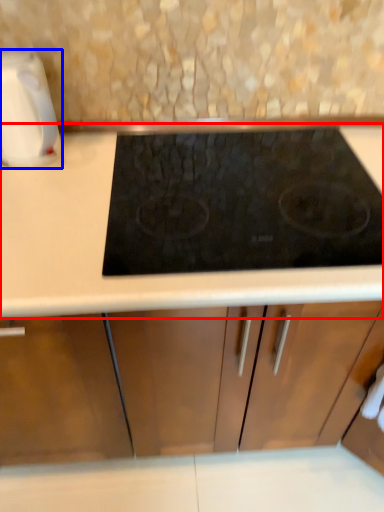
Question: Which of the following is the farthest to the observer, countertop (highlighted by a red box) or kitchen appliance (highlighted by a blue box)?

Choices:
 (A) countertop
 (B) kitchen appliance

Answer: (B)